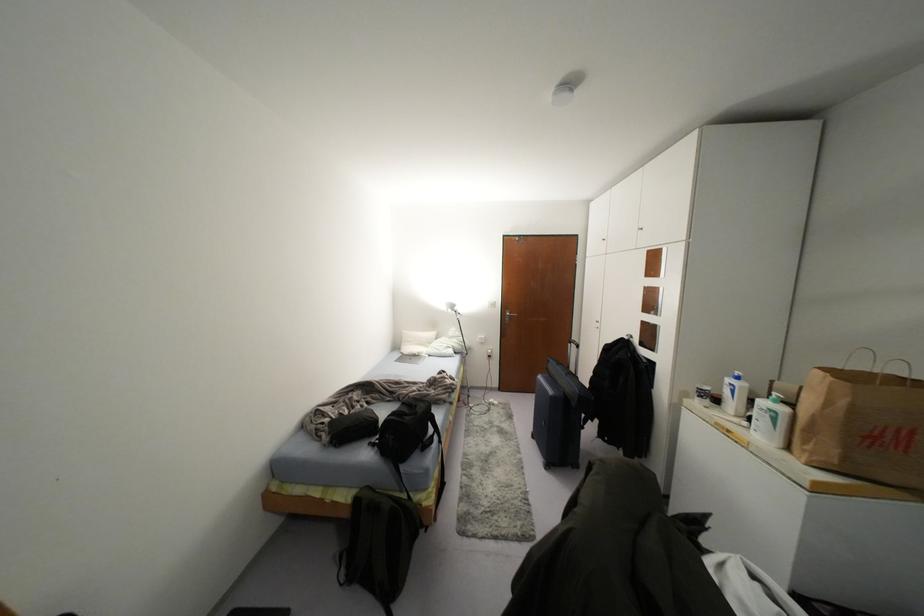
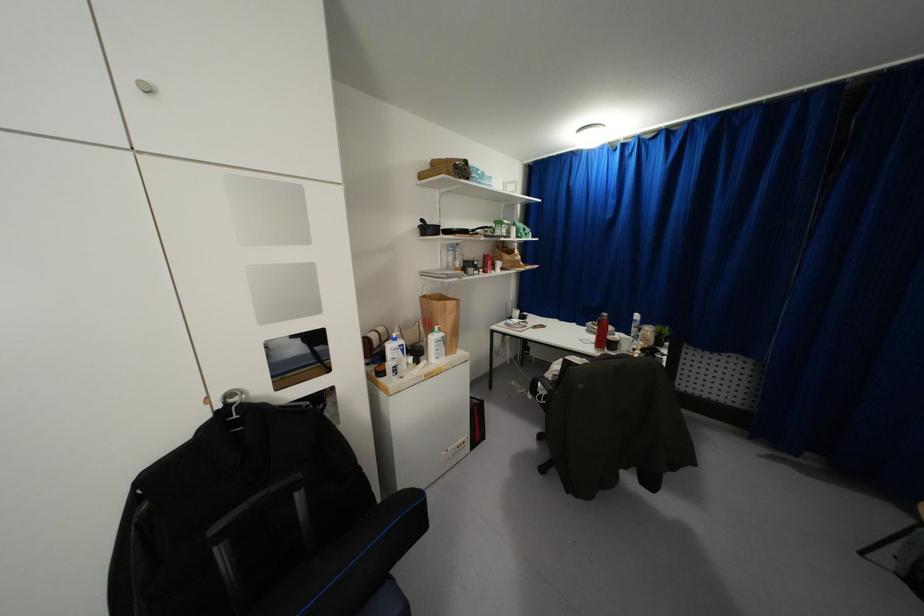
The point at (x=733, y=391) is marked in the first image. Where is the corresponding point in the second image?

(402, 350)